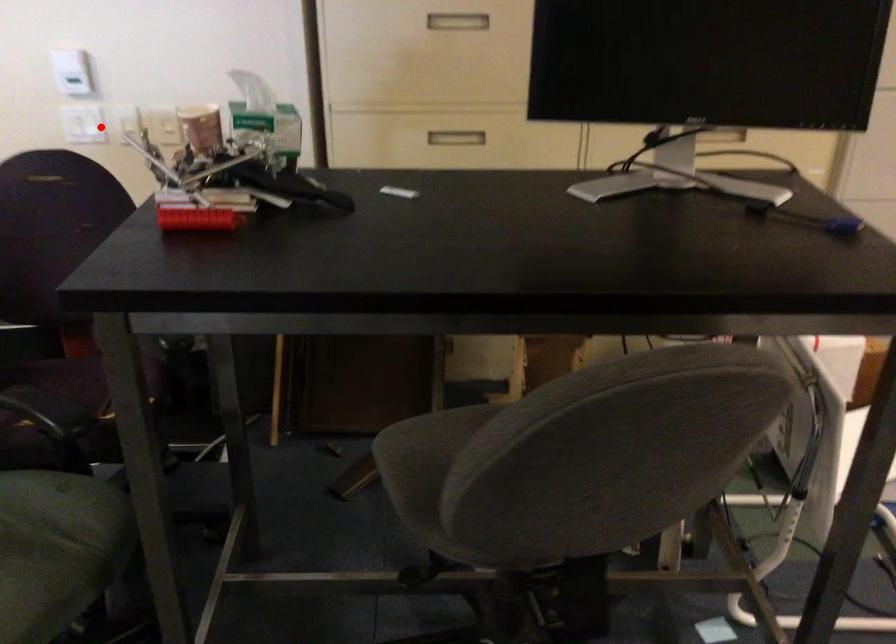
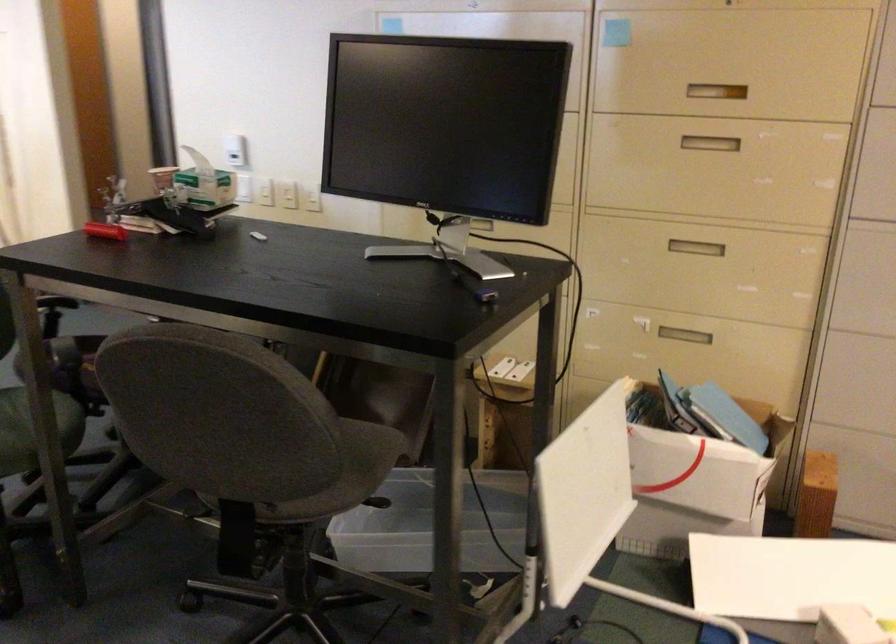
Question: A red point is marked in image1. In image2, is the corresponding 3D point closer to the camera or farther? Reply with the corresponding letter.

Choices:
 (A) The corresponding 3D point is closer.
 (B) The corresponding 3D point is farther.

Answer: (B)